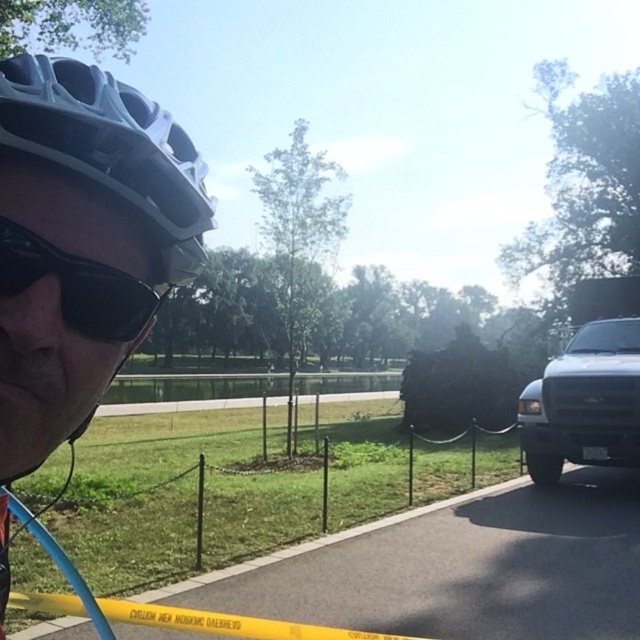
Question: Considering the relative positions of white matte bicycle helmet at upper left and black matte truck at right in the image provided, where is white matte bicycle helmet at upper left located with respect to black matte truck at right?

Choices:
 (A) right
 (B) left

Answer: (B)

Question: Observing the image, what is the correct spatial positioning of black matte truck at right in reference to black matte sunglasses at upper left?

Choices:
 (A) left
 (B) right

Answer: (B)

Question: Which object appears closest to the camera in this image?

Choices:
 (A) black matte truck at right
 (B) black matte sunglasses at upper left
 (C) white matte helmet at upper left
 (D) white matte bicycle helmet at upper left

Answer: (C)

Question: Where is white matte helmet at upper left located in relation to black matte sunglasses at upper left in the image?

Choices:
 (A) above
 (B) below

Answer: (B)

Question: Which object appears farthest from the camera in this image?

Choices:
 (A) black matte sunglasses at upper left
 (B) white matte helmet at upper left
 (C) black matte truck at right

Answer: (C)

Question: Which of the following is the farthest from the observer?

Choices:
 (A) (77, 145)
 (B) (593, 362)
 (C) (35, 369)

Answer: (B)